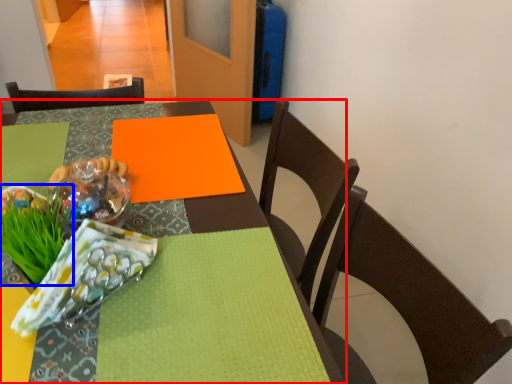
Question: Which of the following is the closest to the observer, table (highlighted by a red box) or grass (highlighted by a blue box)?

Choices:
 (A) table
 (B) grass

Answer: (A)